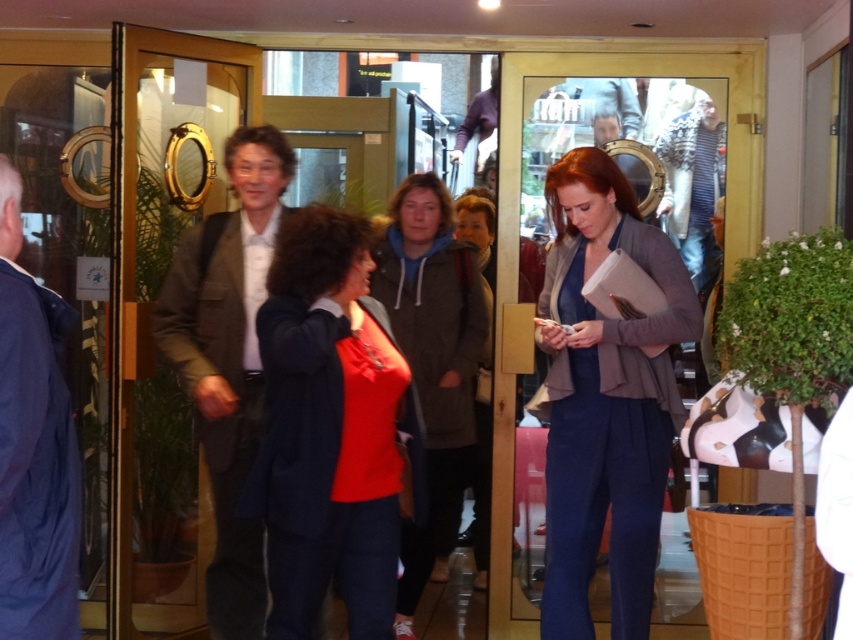
Measure the distance between point (177, 406) and camera.

Point (177, 406) and camera are 4.44 meters apart from each other.

Can you confirm if clear glass door at center is thinner than blue woolen suit at center?

No.

Is point (177, 132) positioned in front of point (567, 349)?

No, (177, 132) is behind (567, 349).

This screenshot has height=640, width=853. Find the location of `clear glass door at center`. clear glass door at center is located at coordinates (163, 308).

What do you see at coordinates (329, 429) in the screenshot? The height and width of the screenshot is (640, 853). I see `matte red blouse at center` at bounding box center [329, 429].

Consider the image. Is matte red blouse at center to the right of gray hoodie at center from the viewer's perspective?

Incorrect, matte red blouse at center is not on the right side of gray hoodie at center.

The width and height of the screenshot is (853, 640). I want to click on matte red blouse at center, so click(x=329, y=429).

Locate an element on the screen. Image resolution: width=853 pixels, height=640 pixels. matte red blouse at center is located at coordinates (329, 429).

Where is `blue woolen suit at center`? blue woolen suit at center is located at coordinates (605, 400).

Is blue woolen suit at center shorter than gray hoodie at center?

Yes, blue woolen suit at center is shorter than gray hoodie at center.

At what (x,y) coordinates should I click in order to perform the action: click on blue woolen suit at center. Please return your answer as a coordinate pair (x, y). This screenshot has width=853, height=640. Looking at the image, I should click on (605, 400).

Locate an element on the screen. The image size is (853, 640). blue woolen suit at center is located at coordinates (605, 400).